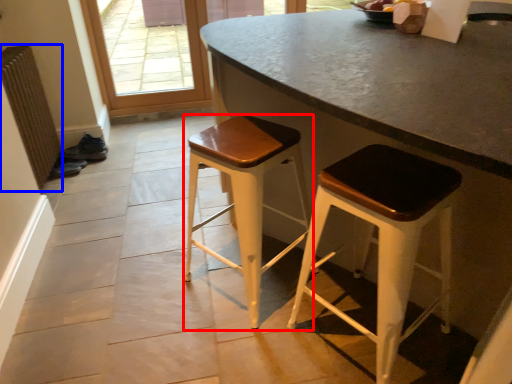
Question: Among these objects, which one is nearest to the camera, stool (highlighted by a red box) or radiator (highlighted by a blue box)?

Choices:
 (A) stool
 (B) radiator

Answer: (A)